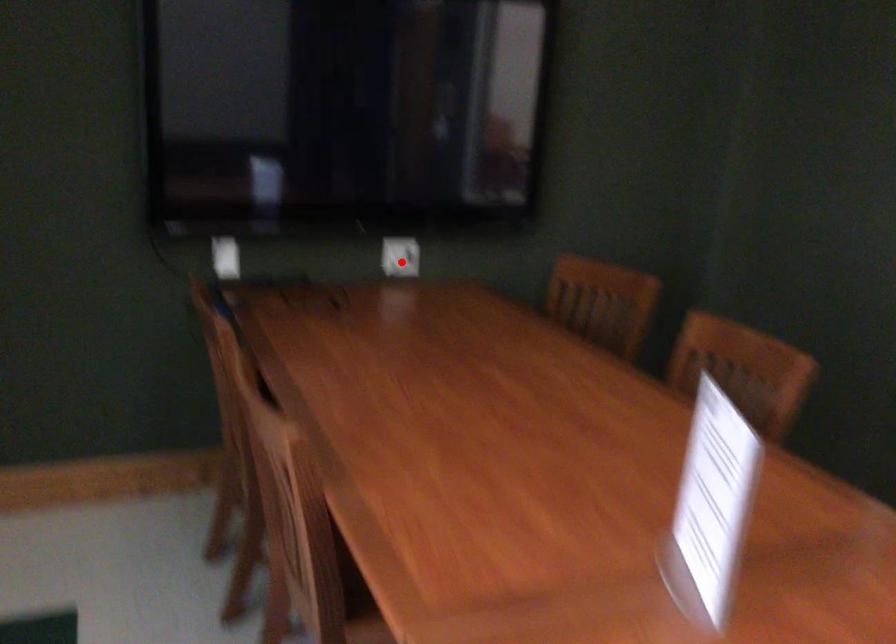
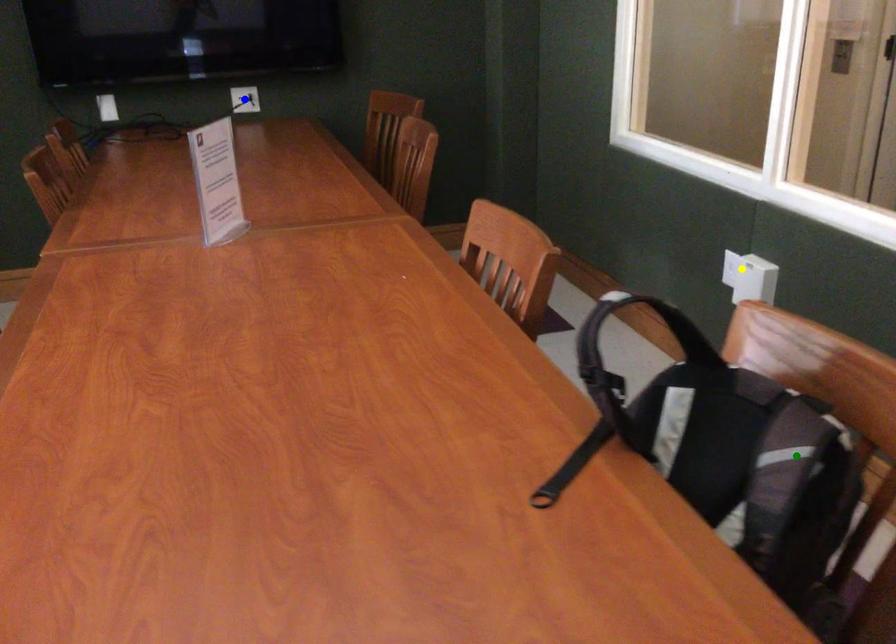
Question: I am providing you with two images of the same scene from different viewpoints. A red point is marked on the first image. You are given multiple points on the second image. Which point in image 2 represents the same 3d spot as the red point in image 1?

Choices:
 (A) yellow point
 (B) blue point
 (C) green point

Answer: (B)